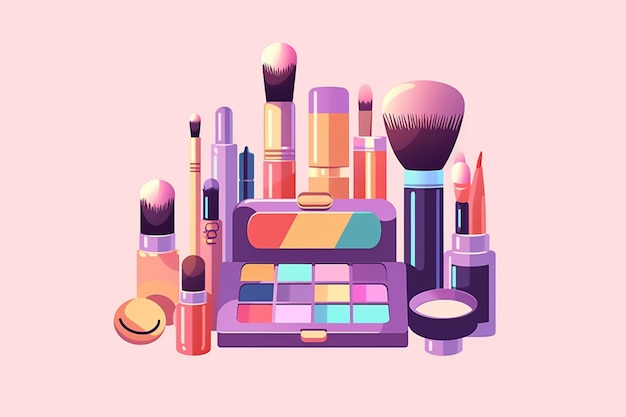
Identify the location of mirror. The width and height of the screenshot is (626, 417). (337, 221).